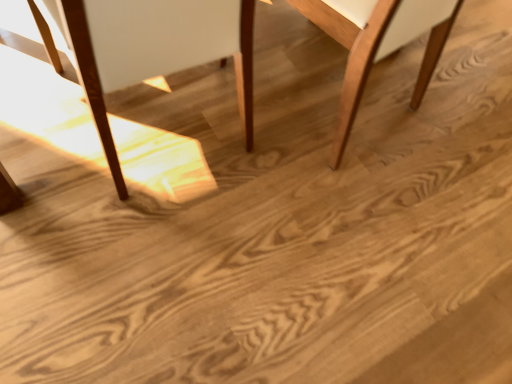
Question: From the image's perspective, is light brown wood chair at center, the 2th chair from the left, on top of matte wood chair at left, acting as the 2th chair starting from the right?

Choices:
 (A) no
 (B) yes

Answer: (B)

Question: Can you confirm if light brown wood chair at center, which is counted as the first chair, starting from the right, is wider than matte wood chair at left, acting as the 2th chair starting from the right?

Choices:
 (A) yes
 (B) no

Answer: (B)

Question: Could matte wood chair at left, placed as the 1th chair when sorted from left to right, be considered to be inside light brown wood chair at center, the 2th chair from the left?

Choices:
 (A) no
 (B) yes

Answer: (A)

Question: Considering the relative positions of light brown wood chair at center, the 2th chair from the left, and matte wood chair at left, placed as the 1th chair when sorted from left to right, in the image provided, is light brown wood chair at center, the 2th chair from the left, behind matte wood chair at left, placed as the 1th chair when sorted from left to right,?

Choices:
 (A) no
 (B) yes

Answer: (B)

Question: Is light brown wood chair at center, the 2th chair from the left, positioned with its back to matte wood chair at left, placed as the 1th chair when sorted from left to right?

Choices:
 (A) yes
 (B) no

Answer: (B)

Question: Would you consider light brown wood chair at center, which is counted as the first chair, starting from the right, to be distant from matte wood chair at left, placed as the 1th chair when sorted from left to right?

Choices:
 (A) no
 (B) yes

Answer: (A)

Question: Can light brown wood chair at center, the 2th chair from the left, be found inside matte wood chair at left, placed as the 1th chair when sorted from left to right?

Choices:
 (A) no
 (B) yes

Answer: (A)

Question: Does matte wood chair at left, acting as the 2th chair starting from the right, come in front of light brown wood chair at center, which is counted as the first chair, starting from the right?

Choices:
 (A) yes
 (B) no

Answer: (A)

Question: Does matte wood chair at left, acting as the 2th chair starting from the right, have a lesser width compared to light brown wood chair at center, the 2th chair from the left?

Choices:
 (A) no
 (B) yes

Answer: (A)

Question: Considering the relative sizes of matte wood chair at left, acting as the 2th chair starting from the right, and light brown wood chair at center, which is counted as the first chair, starting from the right, in the image provided, is matte wood chair at left, acting as the 2th chair starting from the right, taller than light brown wood chair at center, which is counted as the first chair, starting from the right,?

Choices:
 (A) yes
 (B) no

Answer: (A)

Question: From a real-world perspective, is matte wood chair at left, placed as the 1th chair when sorted from left to right, physically above light brown wood chair at center, the 2th chair from the left?

Choices:
 (A) no
 (B) yes

Answer: (B)

Question: Is matte wood chair at left, placed as the 1th chair when sorted from left to right, positioned beyond the bounds of light brown wood chair at center, the 2th chair from the left?

Choices:
 (A) no
 (B) yes

Answer: (B)

Question: Relative to light brown wood chair at center, which is counted as the first chair, starting from the right, is matte wood chair at left, acting as the 2th chair starting from the right, in front or behind?

Choices:
 (A) behind
 (B) front

Answer: (B)